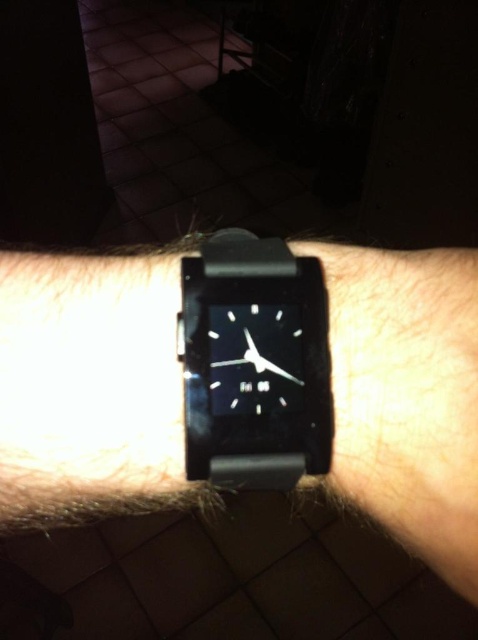
You are trying to decide between two watches on a wrist. You see the black matte watch at center and the black rubber watch at center. Which one is positioned lower on your wrist?

The black matte watch at center is positioned below the black rubber watch at center, so it is lower on the wrist.

You are a designer trying to place a new logo on the black matte watch at center. The logo must be placed at a specific coordinate. Is the point at coordinate (x=89, y=387) on the black matte watch at center?

The point at coordinate (x=89, y=387) is on the black matte watch at center as indicated by the description.

You are trying to decide which watch to wear today. You have two options on your desk, the black matte watch at center and the black rubber watch at center. When looking at them side by side, which one is on the left?

The black matte watch at center is positioned on the left side of the black rubber watch at center, so the black matte watch at center is on the left.